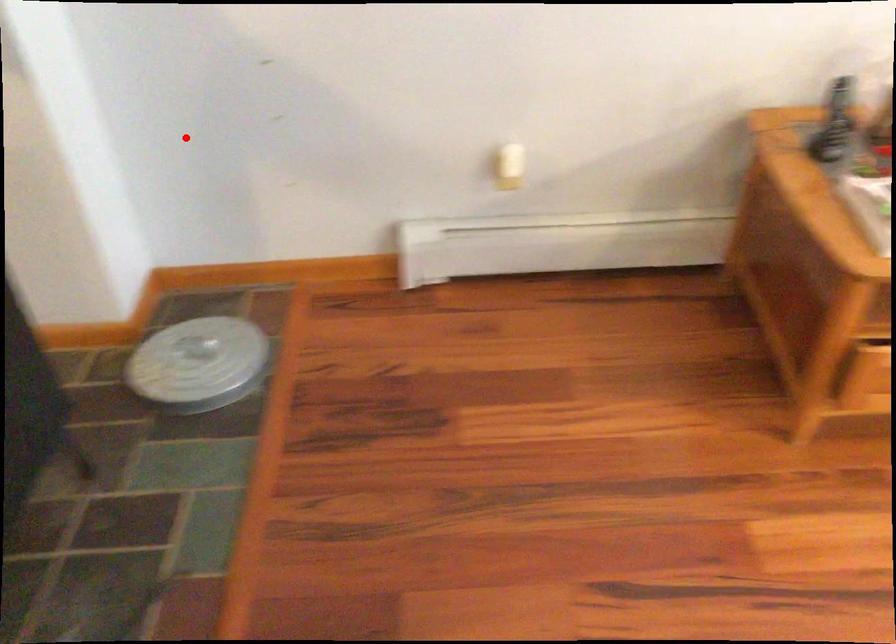
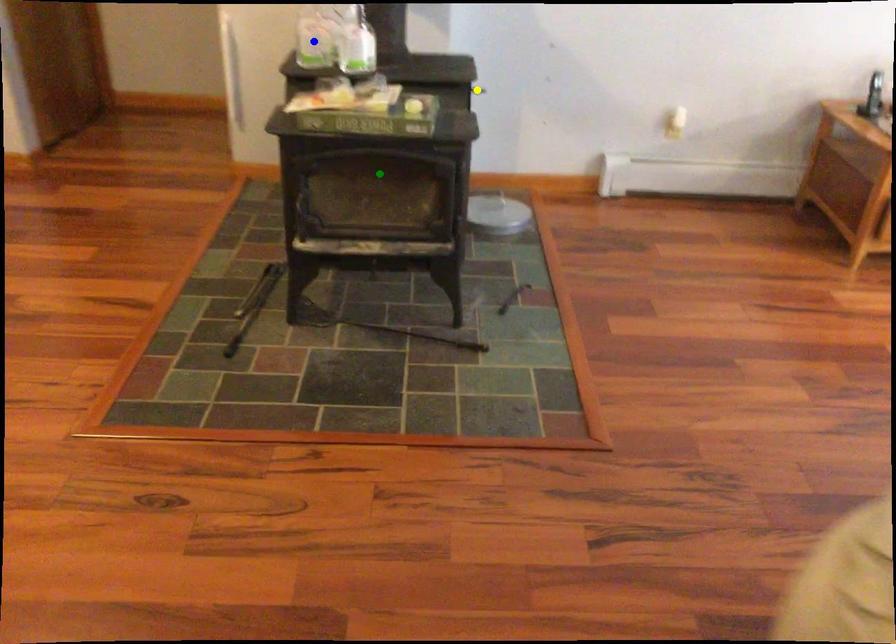
Question: I am providing you with two images of the same scene from different viewpoints. A red point is marked on the first image. You are given multiple points on the second image. In image 2, which mark is for the same physical point as the one in image 1?

Choices:
 (A) blue point
 (B) yellow point
 (C) green point

Answer: (B)